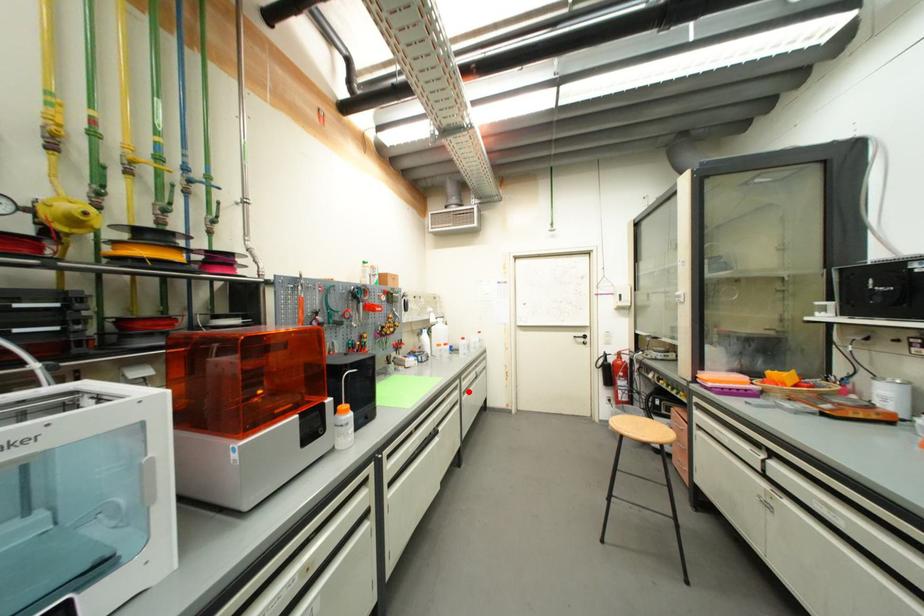
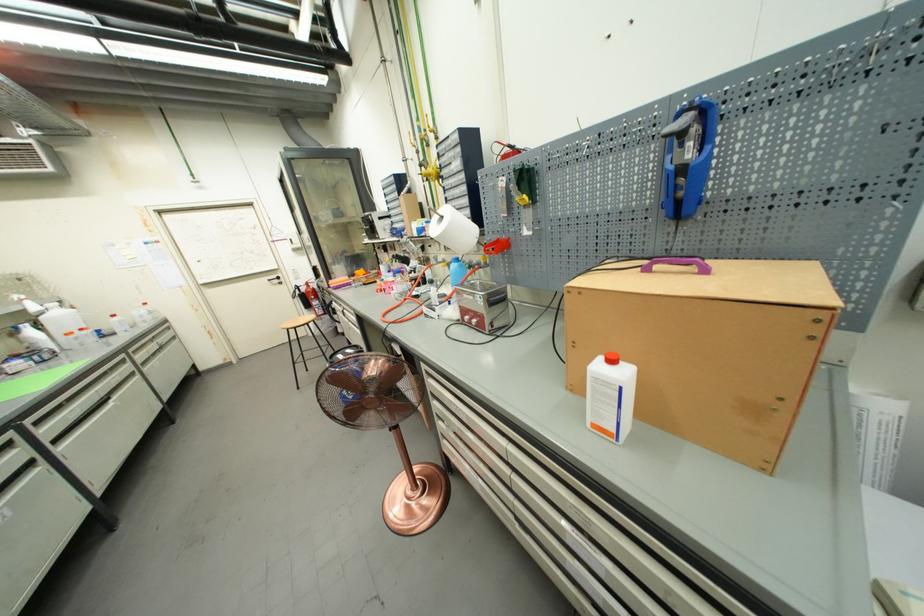
Question: I am providing you with two images of the same scene from different viewpoints. Given a red point in image1, look at the same physical point in image2. Is it:

Choices:
 (A) Closer to the viewpoint
 (B) Farther from the viewpoint

Answer: (A)